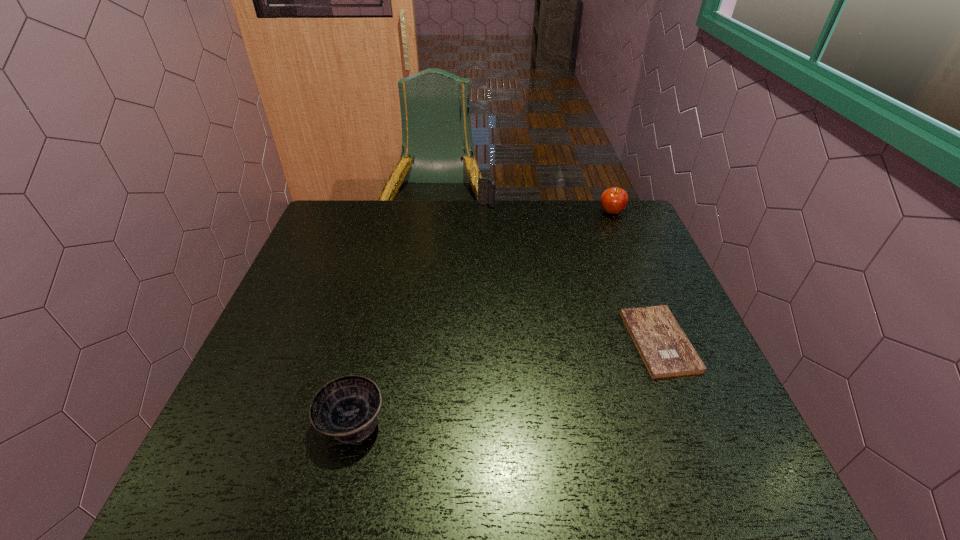
I want to click on free spot between the nearest object and the Bible, so click(505, 381).

The height and width of the screenshot is (540, 960). I want to click on vacant space in between the third tallest object and the cellular telephone, so click(x=420, y=313).

The width and height of the screenshot is (960, 540). Identify the location of the closest object to the second tallest object. (486, 187).

Identify which object is the third closest to the Bible. Please provide its 2D coordinates. Your answer should be formatted as a tuple, i.e. [(x, y)], where the tuple contains the x and y coordinates of a point satisfying the conditions above.

[(486, 187)]

At what (x,y) coordinates should I click in order to perform the action: click on free space that satisfies the following two spatial constraints: 1. on the keyboard of the third farthest object; 2. on the right side of the cellular telephone. Please return your answer as a coordinate pair (x, y). The width and height of the screenshot is (960, 540). Looking at the image, I should click on (490, 340).

This screenshot has width=960, height=540. What are the coordinates of `vacant space that satisfies the following two spatial constraints: 1. on the keyboard of the tallest object; 2. on the right side of the second nearest object` in the screenshot? It's located at (490, 340).

Identify the location of vacant space that satisfies the following two spatial constraints: 1. on the keyboard of the apple; 2. on the right side of the tallest object. (487, 212).